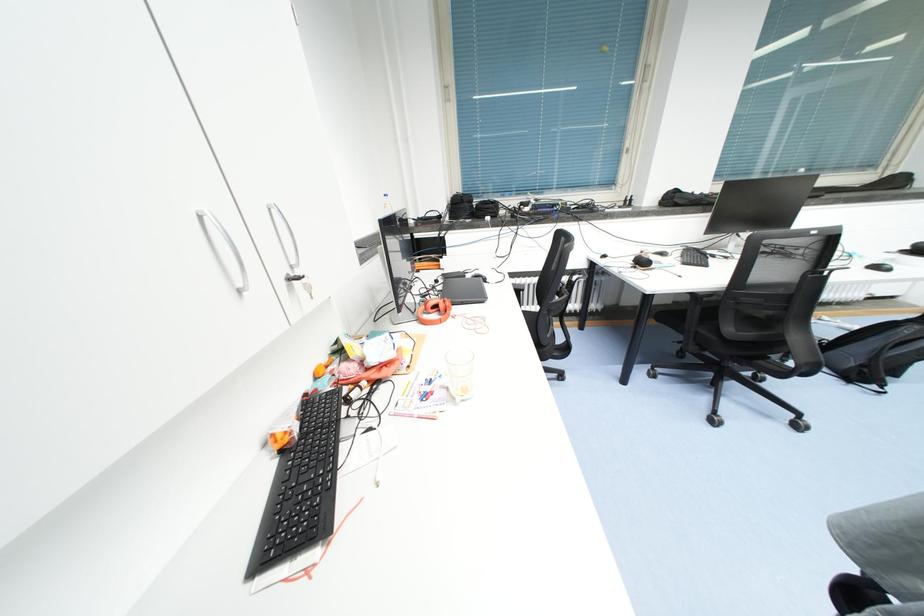
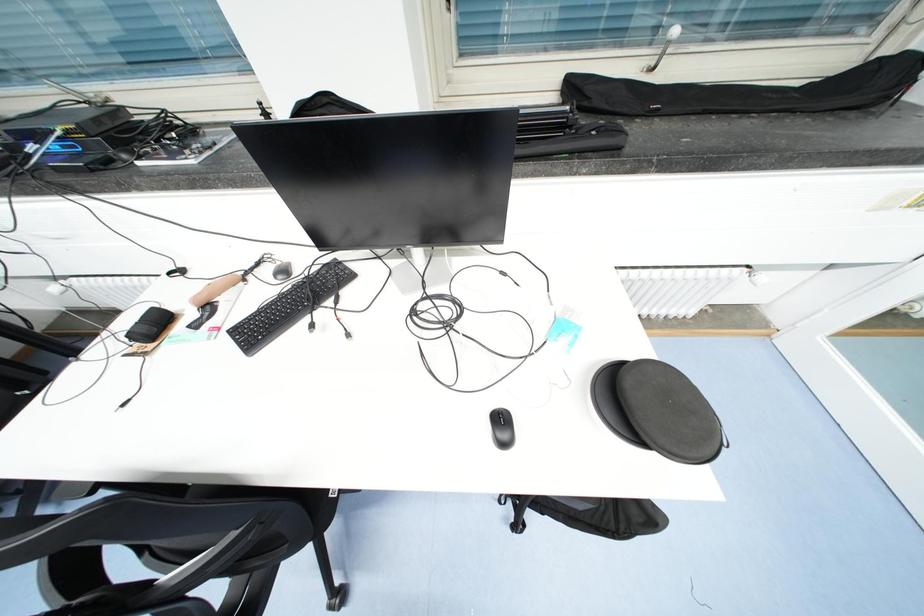
Which direction would the cameraman need to move to produce the second image?

The cameraman walked toward right, forward.